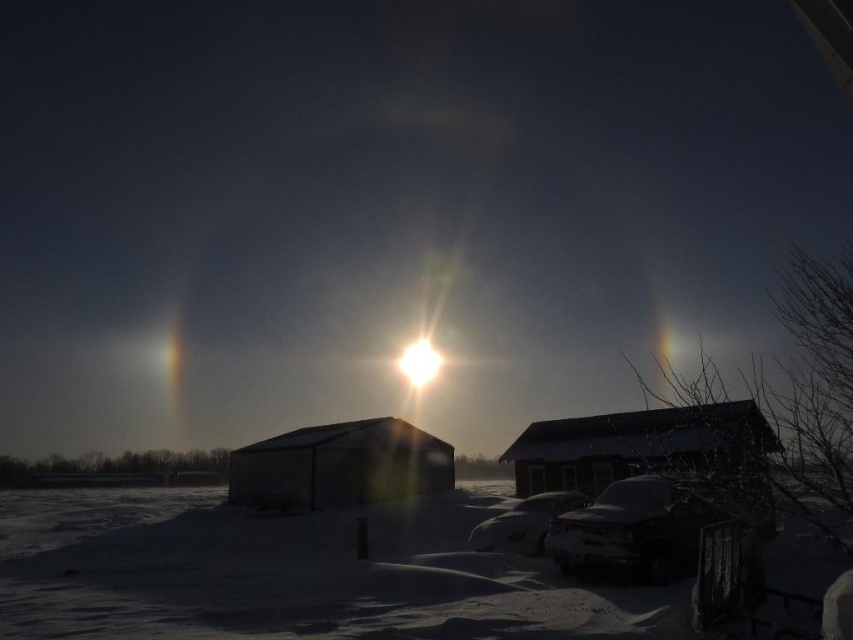
You are standing in the snow and see two cars, the white frosty car at lower right and the white glossy car at lower center. Which car is positioned more to the right side?

The white frosty car at lower right is positioned more to the right side than the white glossy car at lower center.

You are a delivery driver who needs to park your vehicle in this snowy area. You have two cars available, the white frosty car at lower right and the white glossy car at lower center. Which car should you choose if you need a larger vehicle for carrying more packages?

The white glossy car at lower center is larger in size compared to the white frosty car at lower right, so you should choose the white glossy car at lower center for carrying more packages.